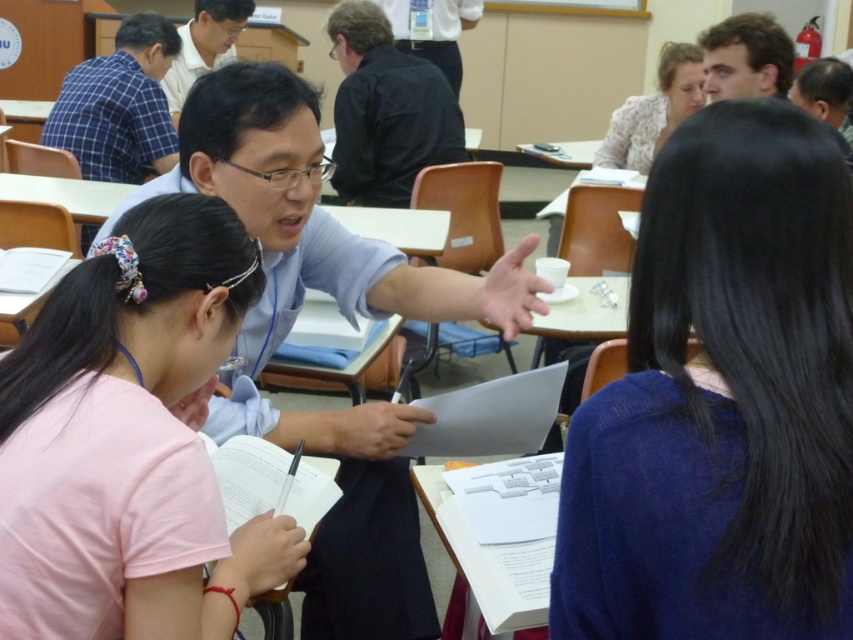
You are standing in the classroom and want to reach the point marked as point (x=171, y=332). If your height is 1.7 meters, will you be able to see the point from your current position?

The point (x=171, y=332) is 1.13 meters away from the viewer. Since the distance is within a typical line of sight range and there are no mentioned obstacles in the scene description, you should be able to see the point from your current position.

You are a photographer trying to capture a group photo of the classroom scene. You notice the floral fabric blouse at upper right and the matte black shirt at upper center. Which of these two shirts should you adjust to ensure both are fully visible in the frame?

The floral fabric blouse at upper right has a lesser height compared to matte black shirt at upper center. Therefore, you should adjust the floral fabric blouse at upper right to ensure both are fully visible in the frame.

You are standing in the classroom and want to reach the point at coordinates (392, 68). If your walking speed is 1.2 meters per second, how many seconds will it take you to reach that point?

The distance to the point is 3.92 meters. At a speed of 1.2 meters per second, the time required is 3.92 divided by 1.2, which equals approximately 3.27 seconds. Therefore, it will take about 3.27 seconds to reach the point.